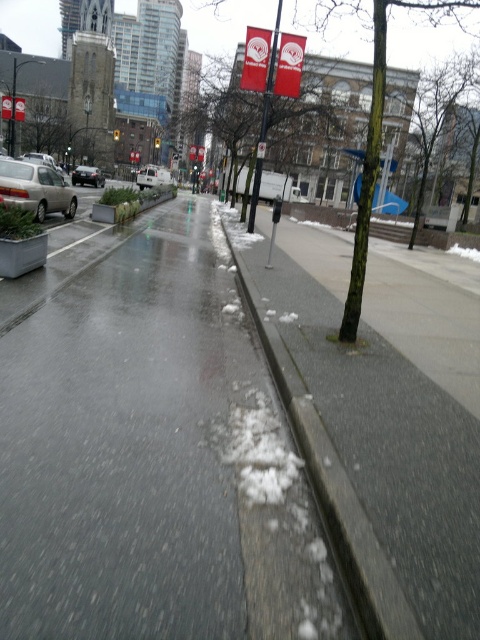
You are a delivery person trying to navigate a narrow alleyway. You see the gray concrete curb at lower center and the silver metallic sedan at left. Which object is higher in height?

The gray concrete curb at lower center is taller than the silver metallic sedan at left.

You are a delivery person trying to park your white matte van at center on the gray asphalt pavement at center. Based on the scene, can your van fit on the pavement?

The gray asphalt pavement at center is thinner than the white matte van at center, so the van cannot fit on the pavement because the pavement is narrower than the vehicle.